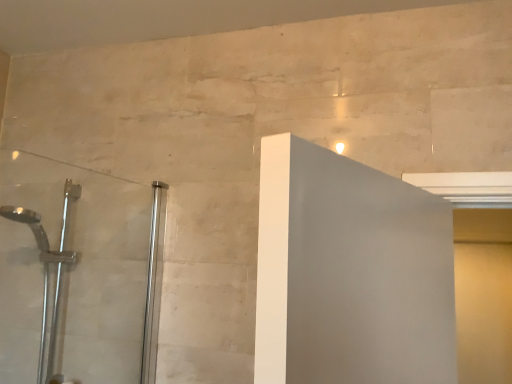
The image size is (512, 384). What are the coordinates of `silver metallic shower head at left` in the screenshot? It's located at (49, 272).

At what (x,y) coordinates should I click in order to perform the action: click on clear glass shower door at left. Please return your answer as a coordinate pair (x, y). This screenshot has height=384, width=512. Looking at the image, I should click on (78, 273).

The width and height of the screenshot is (512, 384). In order to click on silver metallic shower head at left in this screenshot , I will do `click(49, 272)`.

From a real-world perspective, is matte yellow screen door at right physically above silver metallic shower head at left?

No, from a real-world perspective, matte yellow screen door at right is not on top of silver metallic shower head at left.

In the scene shown: Which is more to the left, matte yellow screen door at right or silver metallic shower head at left?

From the viewer's perspective, silver metallic shower head at left appears more on the left side.

From a real-world perspective, is silver metallic shower head at left over clear glass shower door at left?

Incorrect, from a real-world perspective, silver metallic shower head at left is lower than clear glass shower door at left.

Between point (63, 208) and point (87, 364), which one is positioned in front?

The point (87, 364) is in front.

Considering the sizes of silver metallic shower head at left and clear glass shower door at left in the image, is silver metallic shower head at left taller or shorter than clear glass shower door at left?

Considering their sizes, silver metallic shower head at left has more height than clear glass shower door at left.

Is silver metallic shower head at left to the left of clear glass shower door at left from the viewer's perspective?

Indeed, silver metallic shower head at left is positioned on the left side of clear glass shower door at left.

Who is shorter, clear glass shower door at left or matte yellow screen door at right?

clear glass shower door at left.

From a real-world perspective, is clear glass shower door at left positioned above or below matte yellow screen door at right?

clear glass shower door at left is above matte yellow screen door at right.

Does point (128, 271) come closer to viewer compared to point (456, 219)?

Yes.

Is matte yellow screen door at right at the right side of clear glass shower door at left?

Indeed, matte yellow screen door at right is positioned on the right side of clear glass shower door at left.

How different are the orientations of matte yellow screen door at right and clear glass shower door at left in degrees?

The facing directions of matte yellow screen door at right and clear glass shower door at left are 88.5 degrees apart.

Locate an element on the screen. The height and width of the screenshot is (384, 512). screen door that is under the clear glass shower door at left (from a real-world perspective) is located at coordinates (483, 294).

From the image's perspective, which object appears higher, matte yellow screen door at right or clear glass shower door at left?

clear glass shower door at left, from the image's perspective.

Is silver metallic shower head at left smaller than matte yellow screen door at right?

No.

Between silver metallic shower head at left and matte yellow screen door at right, which one has less height?

Standing shorter between the two is silver metallic shower head at left.

From the image's perspective, which is below, silver metallic shower head at left or matte yellow screen door at right?

From the image's view, matte yellow screen door at right is below.

From a real-world perspective, does silver metallic shower head at left stand above matte yellow screen door at right?

Yes, from a real-world perspective, silver metallic shower head at left is above matte yellow screen door at right.

Could you tell me if clear glass shower door at left is turned towards silver metallic shower head at left?

Yes, clear glass shower door at left is oriented towards silver metallic shower head at left.

Considering the relative sizes of clear glass shower door at left and silver metallic shower head at left in the image provided, is clear glass shower door at left taller than silver metallic shower head at left?

Incorrect, the height of clear glass shower door at left is not larger of that of silver metallic shower head at left.

In the scene shown: How many degrees apart are the facing directions of clear glass shower door at left and silver metallic shower head at left?

The facing directions of clear glass shower door at left and silver metallic shower head at left are 89.9 degrees apart.

Considering the relative sizes of clear glass shower door at left and silver metallic shower head at left in the image provided, is clear glass shower door at left thinner than silver metallic shower head at left?

Indeed, clear glass shower door at left has a lesser width compared to silver metallic shower head at left.

Image resolution: width=512 pixels, height=384 pixels. What are the coordinates of `screen door located below the silver metallic shower head at left (from the image's perspective)` in the screenshot? It's located at (483, 294).

Locate an element on the screen. shower on the left side of clear glass shower door at left is located at coordinates (49, 272).

Considering their positions, is clear glass shower door at left positioned closer to matte yellow screen door at right than silver metallic shower head at left?

clear glass shower door at left lies closer to matte yellow screen door at right than the other object.

From the image, which object appears to be nearer to silver metallic shower head at left, matte yellow screen door at right or clear glass shower door at left?

clear glass shower door at left.

Consider the image. Which object lies further to the anchor point silver metallic shower head at left, clear glass shower door at left or matte yellow screen door at right?

matte yellow screen door at right is further to silver metallic shower head at left.

Considering their positions, is matte yellow screen door at right positioned closer to clear glass shower door at left than silver metallic shower head at left?

silver metallic shower head at left is positioned closer to the anchor clear glass shower door at left.

From the image, which object appears to be nearer to matte yellow screen door at right, silver metallic shower head at left or clear glass shower door at left?

Based on the image, clear glass shower door at left appears to be nearer to matte yellow screen door at right.

From the image, which object appears to be nearer to clear glass shower door at left, silver metallic shower head at left or matte yellow screen door at right?

silver metallic shower head at left.

The width and height of the screenshot is (512, 384). I want to click on shower door between silver metallic shower head at left and matte yellow screen door at right in the horizontal direction, so click(x=78, y=273).